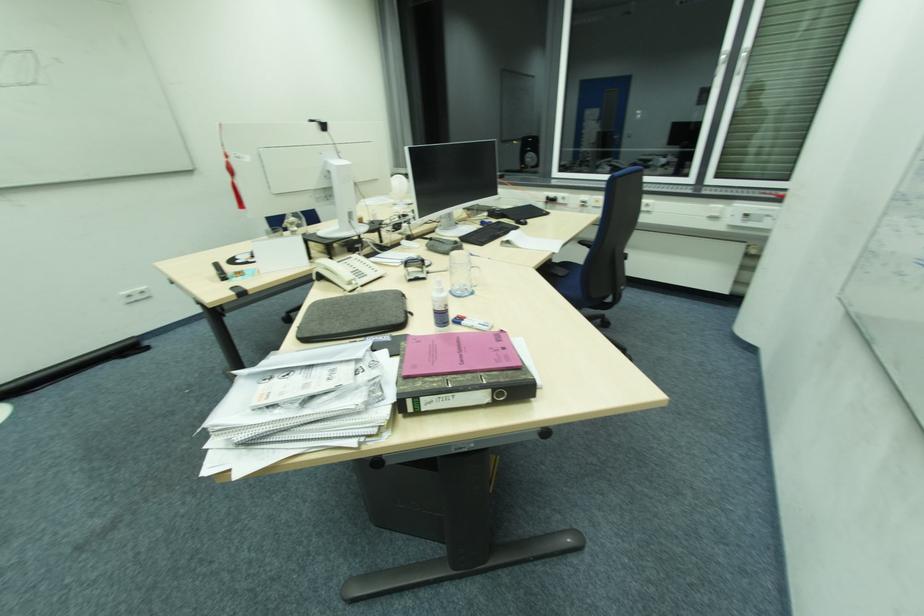
Describe the element at coordinates (553, 270) in the screenshot. I see `the chair armrest` at that location.